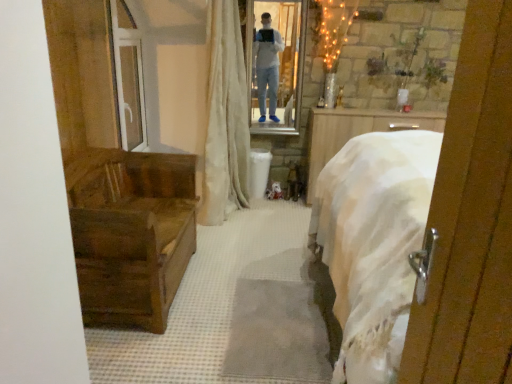
Question: Can you see beige fabric curtain at center touching transparent glass door at upper left?

Choices:
 (A) no
 (B) yes

Answer: (A)

Question: Is beige fabric curtain at center at the left side of transparent glass door at upper left?

Choices:
 (A) yes
 (B) no

Answer: (B)

Question: Does beige fabric curtain at center have a greater height compared to transparent glass door at upper left?

Choices:
 (A) yes
 (B) no

Answer: (A)

Question: From the image's perspective, is beige fabric curtain at center below transparent glass door at upper left?

Choices:
 (A) no
 (B) yes

Answer: (A)

Question: Does beige fabric curtain at center turn towards transparent glass door at upper left?

Choices:
 (A) yes
 (B) no

Answer: (B)

Question: Does beige fabric curtain at center have a smaller size compared to transparent glass door at upper left?

Choices:
 (A) yes
 (B) no

Answer: (B)

Question: Is white glossy mirror at upper center aimed at beige fabric curtain at center?

Choices:
 (A) no
 (B) yes

Answer: (A)

Question: Can you confirm if white glossy mirror at upper center is taller than beige fabric curtain at center?

Choices:
 (A) yes
 (B) no

Answer: (B)

Question: Does white glossy mirror at upper center have a greater width compared to beige fabric curtain at center?

Choices:
 (A) no
 (B) yes

Answer: (A)

Question: Considering the relative positions of white glossy mirror at upper center and beige fabric curtain at center in the image provided, is white glossy mirror at upper center to the right of beige fabric curtain at center from the viewer's perspective?

Choices:
 (A) no
 (B) yes

Answer: (B)

Question: Are white glossy mirror at upper center and beige fabric curtain at center far apart?

Choices:
 (A) yes
 (B) no

Answer: (B)

Question: Considering the relative positions of white glossy mirror at upper center and beige fabric curtain at center in the image provided, is white glossy mirror at upper center to the left of beige fabric curtain at center from the viewer's perspective?

Choices:
 (A) no
 (B) yes

Answer: (A)

Question: Can you confirm if beige fabric curtain at center is positioned to the right of wooden chest at left?

Choices:
 (A) no
 (B) yes

Answer: (B)